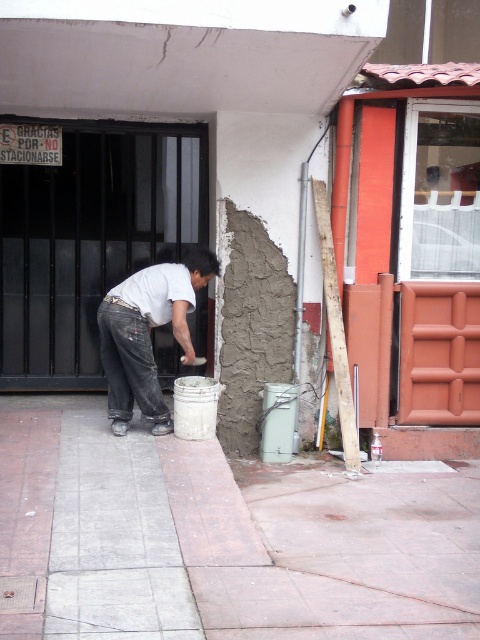
Question: Which object is closer to the camera taking this photo?

Choices:
 (A) white matte shirt at center
 (B) concrete at center

Answer: (B)

Question: Which of the following is the closest to the observer?

Choices:
 (A) (164, 428)
 (B) (147, 593)

Answer: (B)

Question: Where is concrete at center located in relation to white matte shirt at center in the image?

Choices:
 (A) below
 (B) above

Answer: (A)

Question: Can you confirm if concrete at center is smaller than white matte shirt at center?

Choices:
 (A) no
 (B) yes

Answer: (A)

Question: Observing the image, what is the correct spatial positioning of concrete at center in reference to white matte shirt at center?

Choices:
 (A) below
 (B) above

Answer: (A)